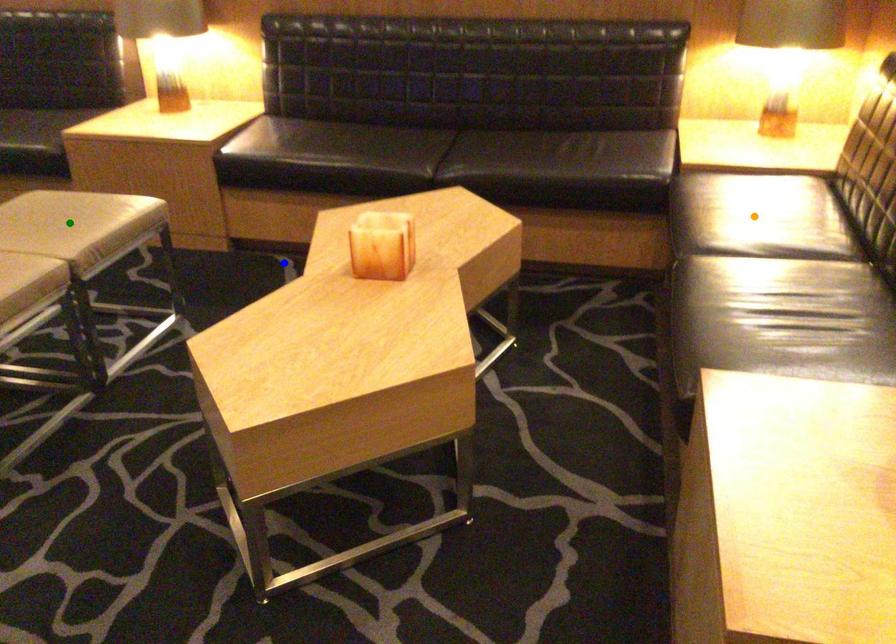
Order these from nearest to farthest:
- blue point
- green point
- orange point

green point < orange point < blue point